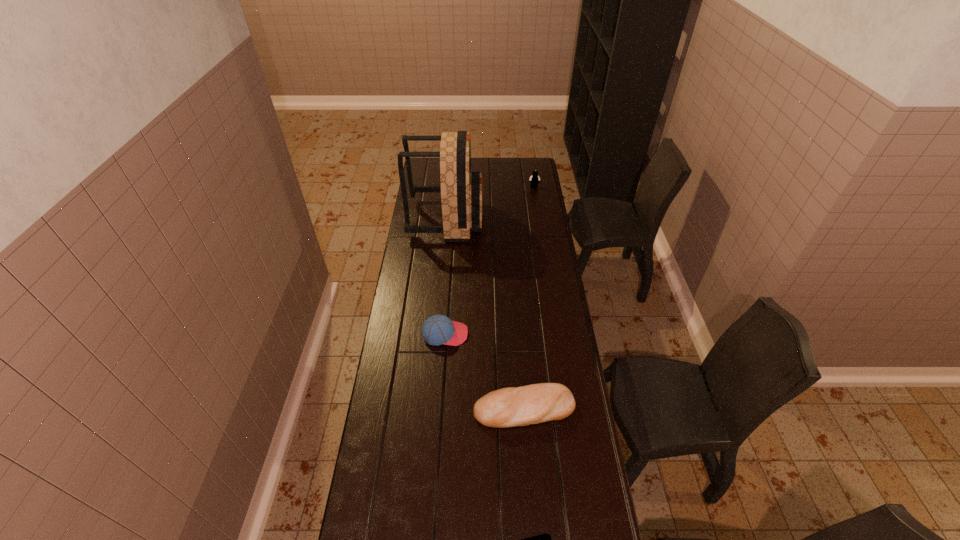
What are the coordinates of `backpack` in the screenshot? It's located at (461, 191).

This screenshot has width=960, height=540. I want to click on the tallest object, so click(x=461, y=191).

The image size is (960, 540). I want to click on the fourth shortest object, so click(x=534, y=179).

Find the location of a particular element. the farthest object is located at coordinates (x=534, y=179).

The image size is (960, 540). Identify the location of the third farthest object. (438, 329).

At what (x,y) coordinates should I click in order to perform the action: click on the fourth farthest object. Please return your answer as a coordinate pair (x, y). The height and width of the screenshot is (540, 960). Looking at the image, I should click on (513, 406).

Where is `vacant space located 0.180m on the front face of the second farthest object`? vacant space located 0.180m on the front face of the second farthest object is located at coordinates (516, 219).

This screenshot has width=960, height=540. I want to click on free space located on the front-facing side of the fourth shortest object, so click(x=536, y=200).

Find the location of a particular element. vacant space located on the front-facing side of the third nearest object is located at coordinates (566, 334).

The width and height of the screenshot is (960, 540). What are the coordinates of `free space located 0.110m on the front of the bread` in the screenshot? It's located at (528, 462).